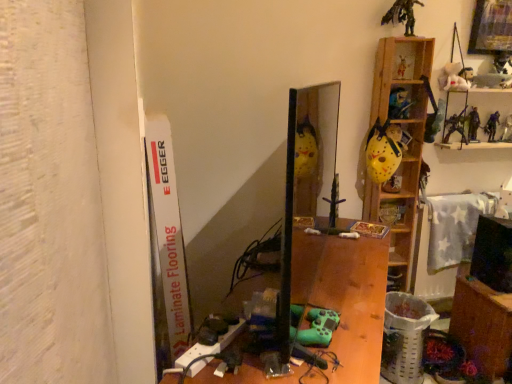
Question: Is wooden desk at center outside of wooden shelf at upper right, the first shelf in the top-to-bottom sequence?

Choices:
 (A) no
 (B) yes

Answer: (B)

Question: From a real-world perspective, does wooden desk at center stand above wooden shelf at upper right, the third shelf in the bottom-to-top sequence?

Choices:
 (A) no
 (B) yes

Answer: (A)

Question: Is the position of wooden desk at center less distant than that of wooden shelf at upper right, the first shelf in the top-to-bottom sequence?

Choices:
 (A) yes
 (B) no

Answer: (A)

Question: From the image's perspective, is wooden desk at center on top of wooden shelf at upper right, the third shelf in the bottom-to-top sequence?

Choices:
 (A) yes
 (B) no

Answer: (B)

Question: Would you say wooden desk at center contains wooden shelf at upper right, the first shelf in the top-to-bottom sequence?

Choices:
 (A) no
 (B) yes

Answer: (A)

Question: Considering the relative sizes of wooden desk at center and wooden shelf at upper right, the third shelf in the bottom-to-top sequence, in the image provided, is wooden desk at center thinner than wooden shelf at upper right, the third shelf in the bottom-to-top sequence,?

Choices:
 (A) yes
 (B) no

Answer: (B)

Question: Is white laminate flooring at left to the right of wooden table at lower right from the viewer's perspective?

Choices:
 (A) no
 (B) yes

Answer: (A)

Question: Is white laminate flooring at left not within wooden table at lower right?

Choices:
 (A) yes
 (B) no

Answer: (A)

Question: Considering the relative sizes of white laminate flooring at left and wooden table at lower right in the image provided, is white laminate flooring at left thinner than wooden table at lower right?

Choices:
 (A) no
 (B) yes

Answer: (B)

Question: Is white laminate flooring at left positioned behind wooden table at lower right?

Choices:
 (A) no
 (B) yes

Answer: (A)

Question: From the image's perspective, would you say white laminate flooring at left is shown under wooden table at lower right?

Choices:
 (A) no
 (B) yes

Answer: (A)

Question: From the image's perspective, is white laminate flooring at left on top of wooden table at lower right?

Choices:
 (A) no
 (B) yes

Answer: (B)

Question: Considering the relative positions of wooden at right, acting as the third shelf starting from the top, and yellow matte helmet at upper right, which is the second shelf in top-to-bottom order, in the image provided, is wooden at right, acting as the third shelf starting from the top, in front of yellow matte helmet at upper right, which is the second shelf in top-to-bottom order,?

Choices:
 (A) yes
 (B) no

Answer: (A)